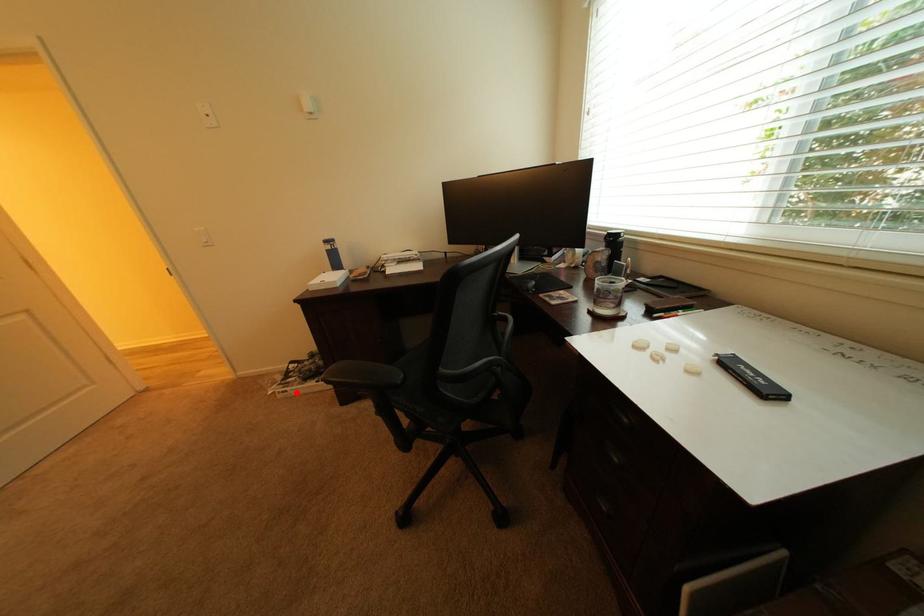
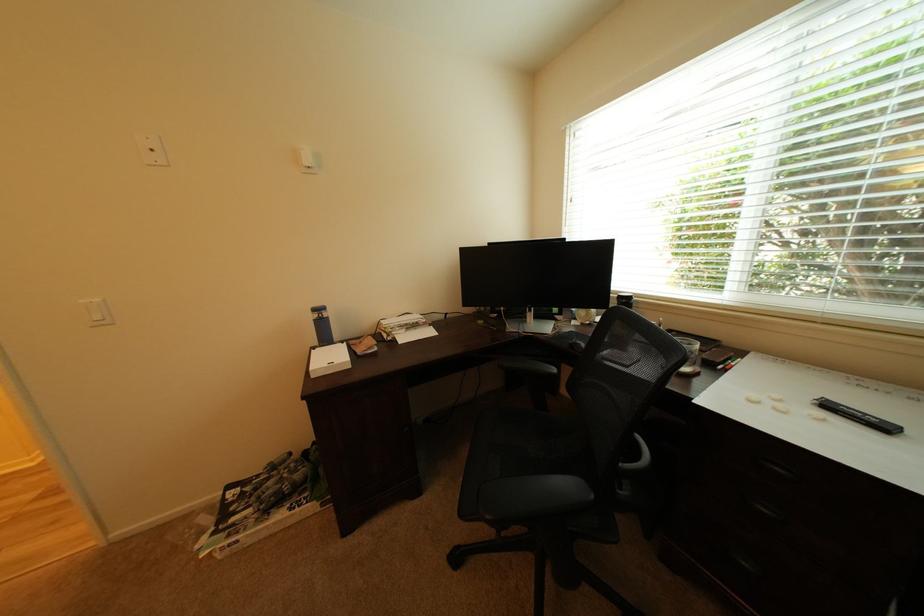
Question: I am providing you with two images of the same scene from different viewpoints. Given a red point in image1, look at the same physical point in image2. Is it:

Choices:
 (A) Closer to the viewpoint
 (B) Farther from the viewpoint

Answer: (A)